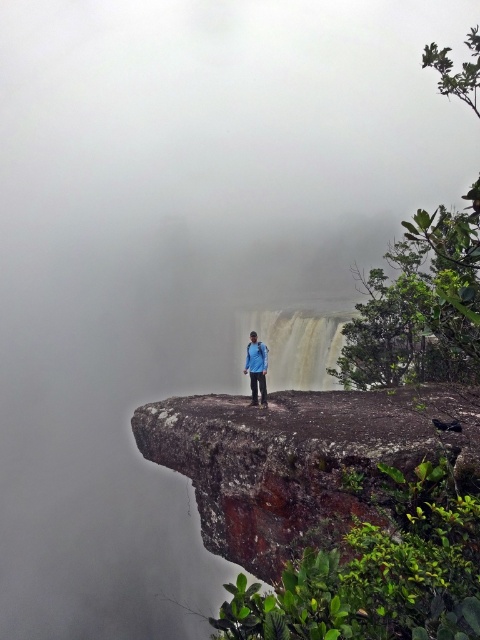
Who is positioned more to the left, smooth white waterfall at center or blue fabric jacket at center?

blue fabric jacket at center is more to the left.

Can you confirm if smooth white waterfall at center is thinner than blue fabric jacket at center?

No.

Does point (312, 316) come in front of point (255, 381)?

No, (312, 316) is behind (255, 381).

Image resolution: width=480 pixels, height=640 pixels. Find the location of `smooth white waterfall at center`. smooth white waterfall at center is located at coordinates (292, 346).

Is rusty rock cliff at center above blue fabric jacket at center?

Incorrect, rusty rock cliff at center is not positioned above blue fabric jacket at center.

Is rusty rock cliff at center shorter than blue fabric jacket at center?

No, rusty rock cliff at center is not shorter than blue fabric jacket at center.

The width and height of the screenshot is (480, 640). What do you see at coordinates (300, 460) in the screenshot? I see `rusty rock cliff at center` at bounding box center [300, 460].

Locate an element on the screen. rusty rock cliff at center is located at coordinates (300, 460).

Is rusty rock cliff at center positioned at the back of smooth white waterfall at center?

No, it is not.

Which is more to the left, rusty rock cliff at center or smooth white waterfall at center?

rusty rock cliff at center

Measure the distance between point (300, 465) and camera.

Point (300, 465) and camera are 9.26 meters apart.

In order to click on rusty rock cliff at center in this screenshot , I will do `click(300, 460)`.